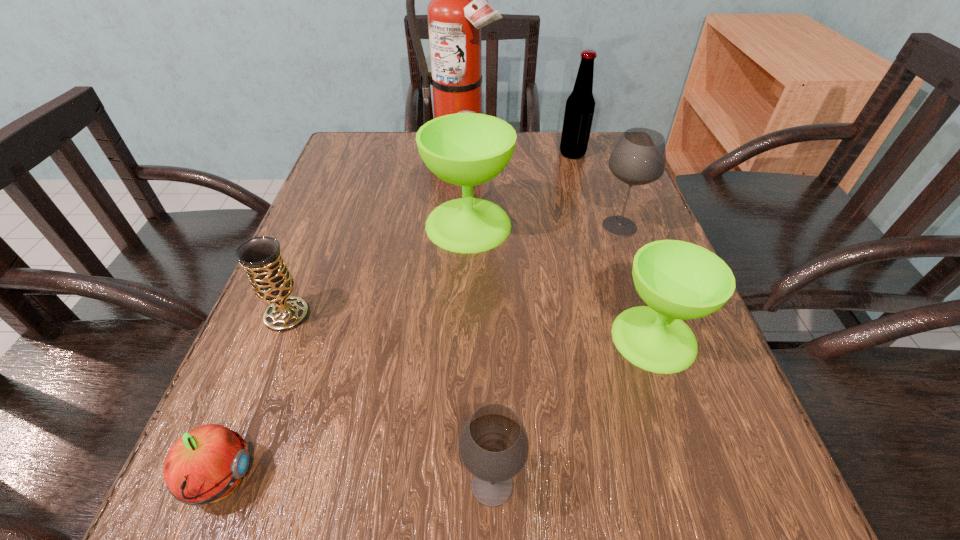
Locate an element on the screen. This screenshot has width=960, height=540. vacant space at the far edge is located at coordinates (400, 167).

In the image, there is a desktop. Where is `vacant space at the near edge`? vacant space at the near edge is located at coordinates (453, 511).

Identify the location of free space at the left edge of the desktop. This screenshot has width=960, height=540. (367, 221).

You are a GUI agent. You are given a task and a screenshot of the screen. Output one action in this format:
    pyautogui.click(x=<x>, y=<y>)
    Task: Click on the blank space at the right edge of the desktop
    The image size is (960, 540).
    Given the screenshot: What is the action you would take?
    pyautogui.click(x=671, y=377)

Locate an element on the screen. The height and width of the screenshot is (540, 960). vacant region at the far left corner is located at coordinates coord(383,139).

Image resolution: width=960 pixels, height=540 pixels. What are the coordinates of `free spot at the far right corner of the desktop` in the screenshot? It's located at (598, 152).

You are a GUI agent. You are given a task and a screenshot of the screen. Output one action in this format:
    pyautogui.click(x=<x>, y=<y>)
    Task: Click on the free space between the chalice and the bigger gray wineglass
    
    Given the screenshot: What is the action you would take?
    pyautogui.click(x=453, y=271)

Where is `free point between the smaller green wineglass and the left green wineglass`? free point between the smaller green wineglass and the left green wineglass is located at coordinates (561, 281).

This screenshot has height=540, width=960. What are the coordinates of `free spot between the smaller green wineglass and the smaller gray wineglass` in the screenshot? It's located at (573, 411).

Where is `unoccupied position between the shortest object and the nearer gray wineglass`? The image size is (960, 540). unoccupied position between the shortest object and the nearer gray wineglass is located at coordinates (356, 483).